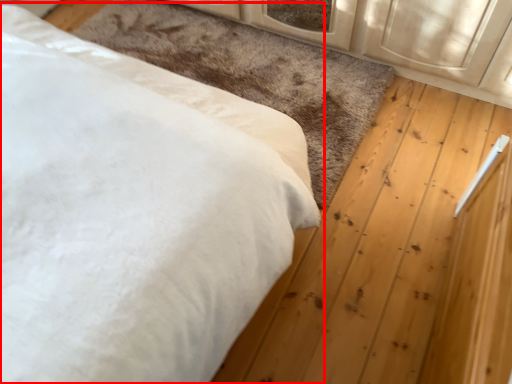
Question: From the image's perspective, where is bed (annotated by the red box) located relative to mat?

Choices:
 (A) above
 (B) below

Answer: (B)